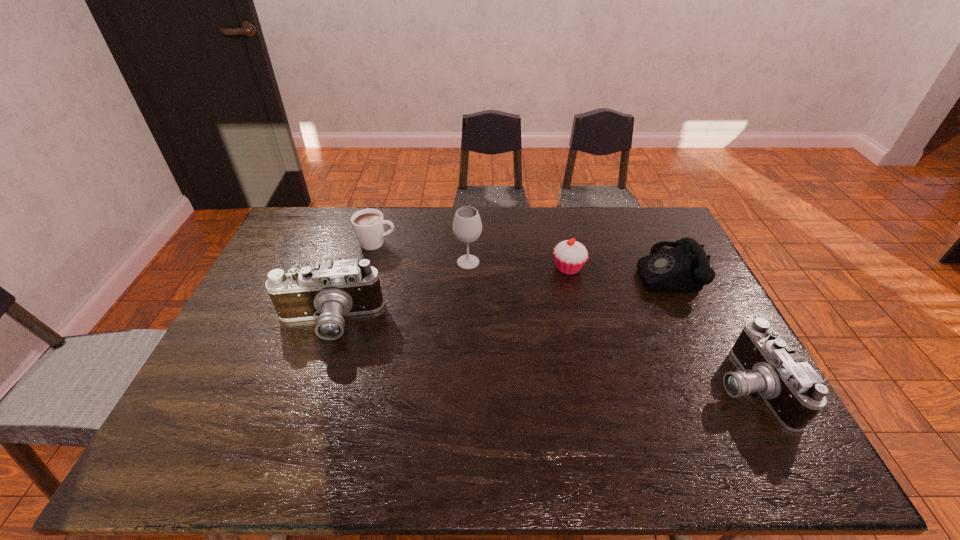
The height and width of the screenshot is (540, 960). What are the coordinates of `free region at the far left corner of the desktop` in the screenshot? It's located at (321, 241).

Identify the location of free space between the cappuccino and the telephone. (520, 257).

Locate an element on the screen. Image resolution: width=960 pixels, height=540 pixels. free spot between the cappuccino and the third object from left to right is located at coordinates (422, 253).

Find the location of a particular element. empty location between the wineglass and the cappuccino is located at coordinates (422, 253).

Locate an element on the screen. The width and height of the screenshot is (960, 540). free space between the cappuccino and the wineglass is located at coordinates (422, 253).

The image size is (960, 540). Identify the location of blank region between the fourth object from left to right and the shorter camera. (659, 327).

Identify which object is located as the nearest to the cupcake. Please provide its 2D coordinates. Your answer should be formatted as a tuple, i.e. [(x, y)], where the tuple contains the x and y coordinates of a point satisfying the conditions above.

[(685, 268)]

Locate which object ranks in proximity to the cappuccino. Please provide its 2D coordinates. Your answer should be formatted as a tuple, i.e. [(x, y)], where the tuple contains the x and y coordinates of a point satisfying the conditions above.

[(467, 226)]

Identify the location of vacant region that satisfies the following two spatial constraints: 1. with the handle on the side of the cupcake; 2. on the left side of the cappuccino. Image resolution: width=960 pixels, height=540 pixels. (370, 268).

Where is `free space that satisfies the following two spatial constraints: 1. on the back side of the third object from left to right; 2. with the handle on the side of the cappuccino`? The height and width of the screenshot is (540, 960). free space that satisfies the following two spatial constraints: 1. on the back side of the third object from left to right; 2. with the handle on the side of the cappuccino is located at coordinates [468, 243].